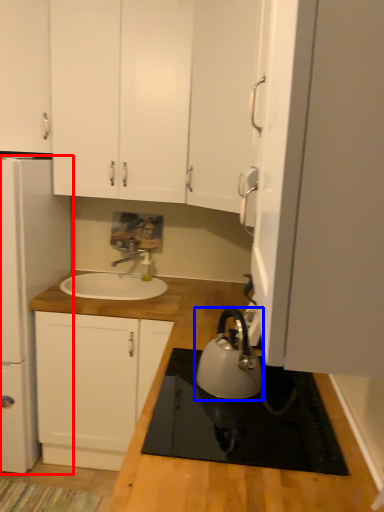
Question: Among these objects, which one is farthest to the camera, home appliance (highlighted by a red box) or kitchen appliance (highlighted by a blue box)?

Choices:
 (A) home appliance
 (B) kitchen appliance

Answer: (A)